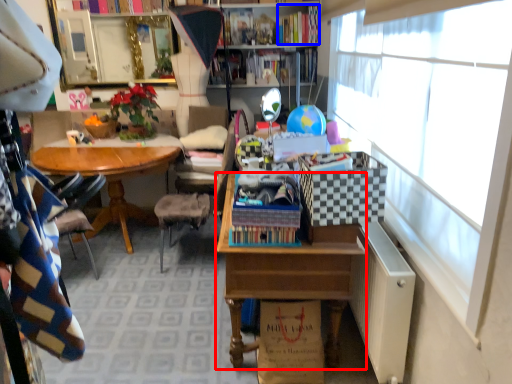
Question: Which of the following is the farthest to the observer, desk (highlighted by a red box) or book (highlighted by a blue box)?

Choices:
 (A) desk
 (B) book

Answer: (B)